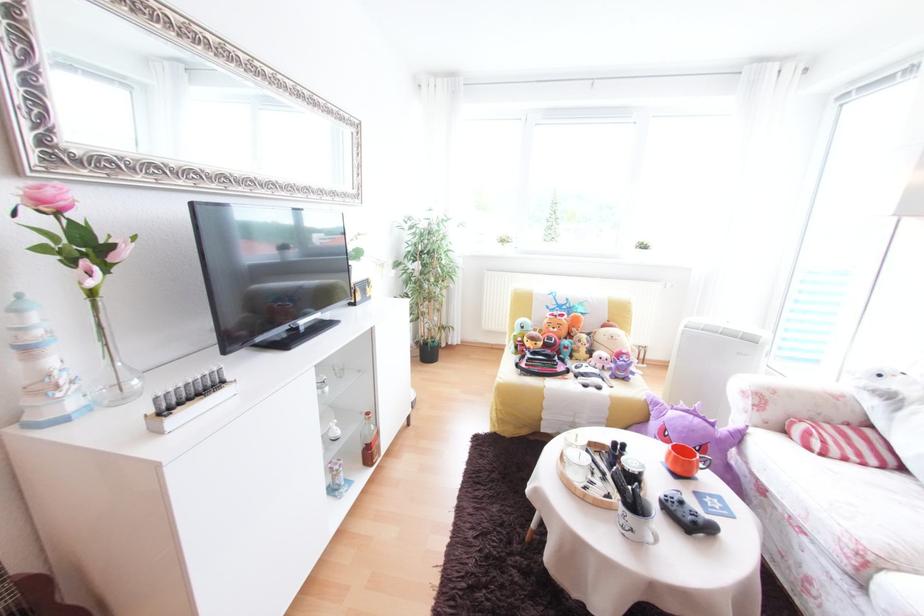
Where would you lift the clear glass vase? Please return your answer as a coordinate pair (x, y).

(112, 363)